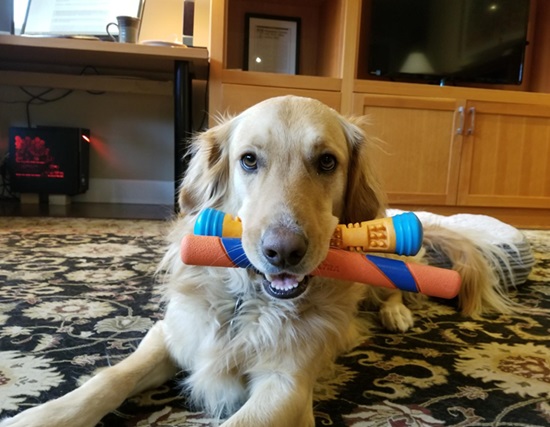
Identify the location of toys. This screenshot has height=427, width=550. (365, 275), (376, 236).